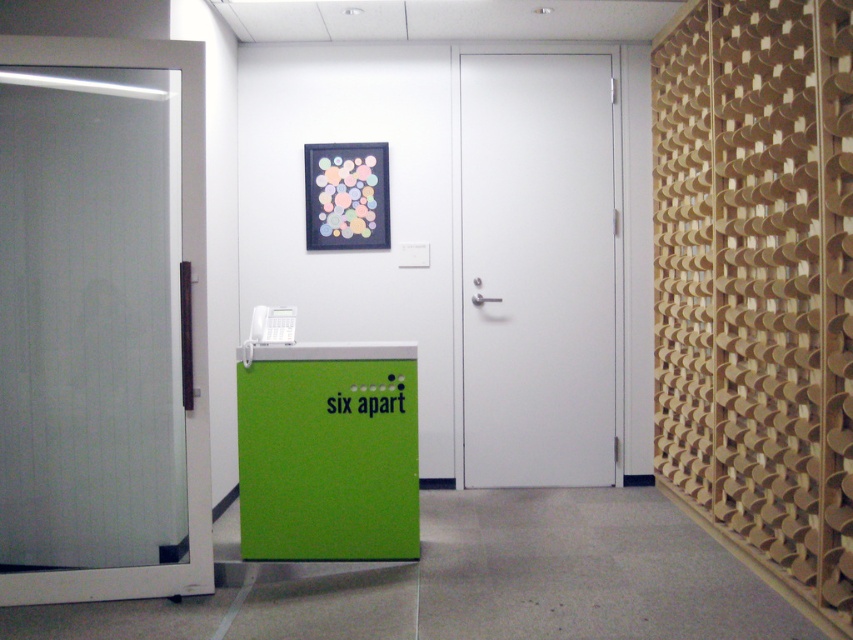
Between point (592, 403) and point (242, 465), which one is positioned behind?

Point (592, 403)

Who is more forward, [488,93] or [292,540]?

Point [292,540]

You are a GUI agent. You are given a task and a screenshot of the screen. Output one action in this format:
    pyautogui.click(x=<x>, y=<y>)
    Task: Click on the white smooth door at center
    
    Given the screenshot: What is the action you would take?
    pyautogui.click(x=537, y=269)

Between wooden slats at right and green matte locker at center, which one appears on the right side from the viewer's perspective?

wooden slats at right

This screenshot has width=853, height=640. What do you see at coordinates (757, 285) in the screenshot?
I see `wooden slats at right` at bounding box center [757, 285].

Is point (705, 317) positioned in front of point (293, 381)?

No, it is behind (293, 381).

I want to click on wooden slats at right, so click(757, 285).

Consider the image. Who is lower down, wooden slats at right or transparent glass door at left?

transparent glass door at left is lower down.

Who is more forward, (706, 468) or (138, 120)?

Point (138, 120)

You are a GUI agent. You are given a task and a screenshot of the screen. Output one action in this format:
    pyautogui.click(x=<x>, y=<y>)
    Task: Click on the wooden slats at right
    This screenshot has width=853, height=640.
    Given the screenshot: What is the action you would take?
    pyautogui.click(x=757, y=285)